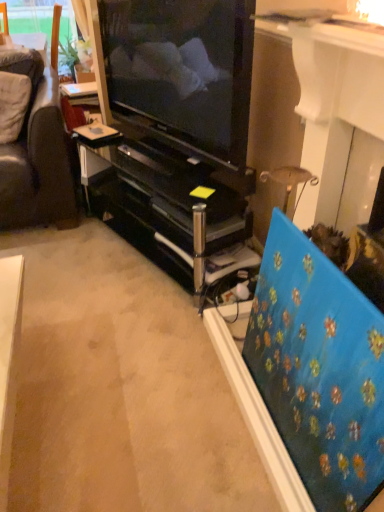
Find the location of a particular element. unoccupied area in front of black glossy tv cabinet at center is located at coordinates (121, 340).